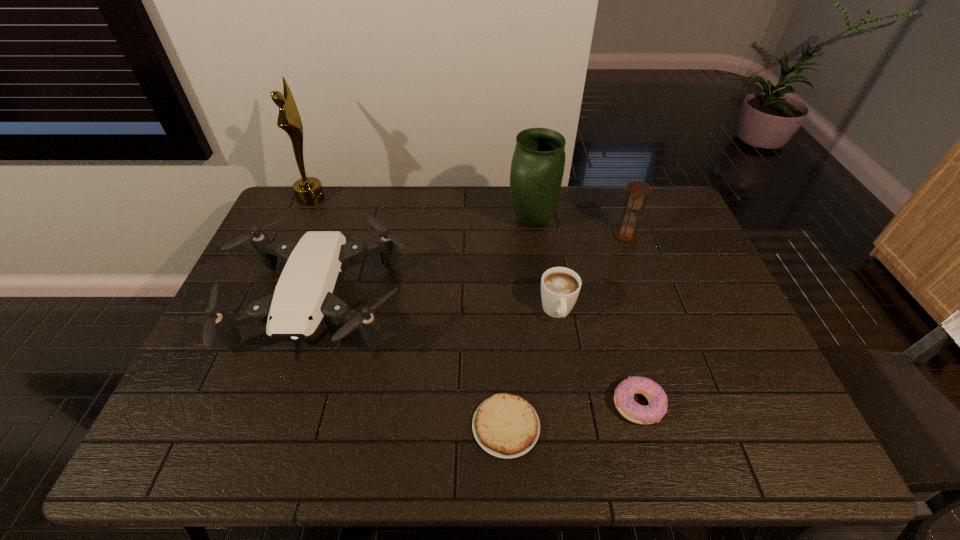
Identify which object is the sixth nearest to the rightmost object. Please provide its 2D coordinates. Your answer should be formatted as a tuple, i.e. [(x, y)], where the tuple contains the x and y coordinates of a point satisfying the conditions above.

[(308, 190)]

The width and height of the screenshot is (960, 540). I want to click on object that is the sixth closest to the second object from right to left, so click(308, 190).

Find the location of `vacant point that satisfies the following two spatial constraints: 1. on the front-facing side of the vase; 2. on the right side of the tallest object`. vacant point that satisfies the following two spatial constraints: 1. on the front-facing side of the vase; 2. on the right side of the tallest object is located at coordinates (300, 221).

Identify the location of vacant area that satisfies the following two spatial constraints: 1. on the front-facing side of the award; 2. on the right side of the third tallest object. The height and width of the screenshot is (540, 960). (294, 235).

What are the coordinates of `free space that satisfies the following two spatial constraints: 1. on the camera side of the tortilla; 2. on the left side of the fourth shortest object` in the screenshot? It's located at (281, 426).

Identify the location of free location that satisfies the following two spatial constraints: 1. on the front-facing side of the award; 2. on the right side of the second object from right to left. (219, 404).

I want to click on vacant space that satisfies the following two spatial constraints: 1. on the front-facing side of the tallest object; 2. on the back side of the rightmost object, so click(294, 235).

I want to click on vacant region that satisfies the following two spatial constraints: 1. on the front-facing side of the tallest object; 2. on the back side of the doughnut, so click(219, 404).

Find the location of a particular element. free spot that satisfies the following two spatial constraints: 1. on the front-facing side of the tallest object; 2. on the back side of the second object from right to left is located at coordinates (219, 404).